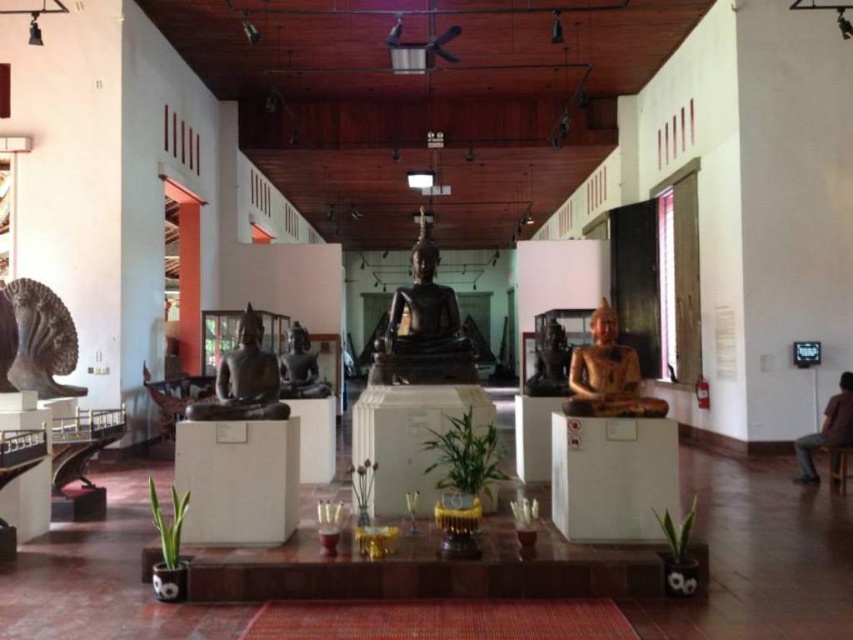
Which is above, matte black statue at left or brown leather chair at lower right?

Positioned higher is matte black statue at left.

Can you confirm if matte black statue at left is shorter than brown leather chair at lower right?

Yes, matte black statue at left is shorter than brown leather chair at lower right.

Where is `matte black statue at left`? matte black statue at left is located at coordinates (242, 380).

Identify the location of gold polished statue at right. (607, 374).

Is gold polished statue at right behind brown leather chair at lower right?

No, gold polished statue at right is closer to the viewer.

Is point (618, 396) positioned before point (838, 394)?

That is True.

I want to click on gold polished statue at right, so click(607, 374).

Is black stone sculpture at left to the left of gold polished statue at center from the viewer's perspective?

Yes, black stone sculpture at left is to the left of gold polished statue at center.

I want to click on black stone sculpture at left, so click(35, 340).

Is point (42, 387) farther from camera compared to point (550, 349)?

That is False.

Where is `black stone sculpture at left`? black stone sculpture at left is located at coordinates (35, 340).